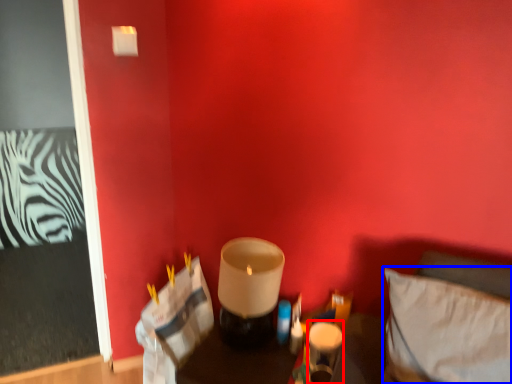
Question: Which object is closer to the camera taking this photo, candle holder (highlighted by a red box) or pillow (highlighted by a blue box)?

Choices:
 (A) candle holder
 (B) pillow

Answer: (B)